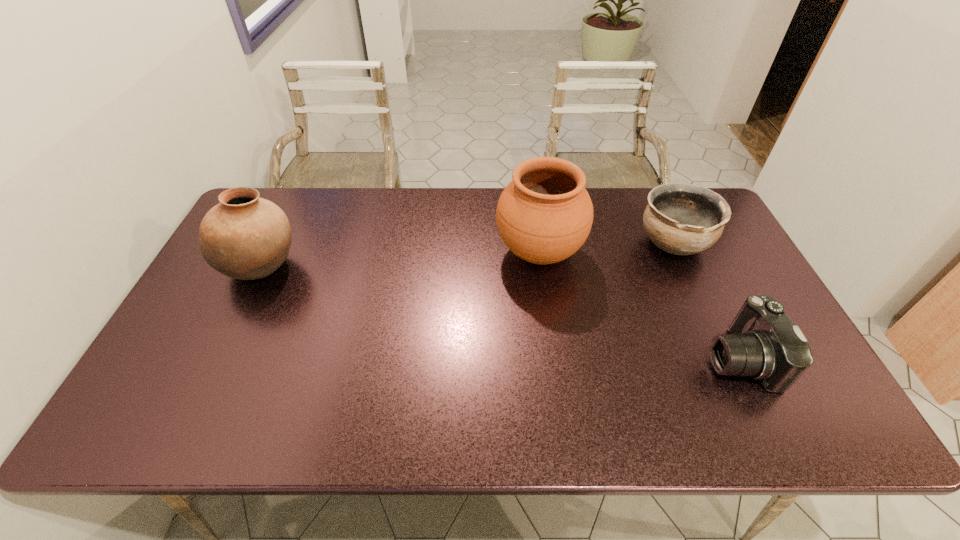
Locate an element on the screen. The image size is (960, 540). object positioned at the left edge is located at coordinates (245, 237).

Where is `pottery that is at the right edge`? This screenshot has width=960, height=540. pottery that is at the right edge is located at coordinates (682, 219).

Find the location of a particular element. This screenshot has width=960, height=540. camera at the right edge is located at coordinates (764, 343).

The width and height of the screenshot is (960, 540). Identify the location of object positioned at the far right corner. (682, 219).

The height and width of the screenshot is (540, 960). In the image, there is a desktop. Identify the location of free space at the far edge. (612, 197).

In the image, there is a desktop. Find the location of `vacant space at the near edge`. vacant space at the near edge is located at coordinates (489, 402).

The width and height of the screenshot is (960, 540). I want to click on vacant space at the left edge of the desktop, so click(173, 398).

The image size is (960, 540). Find the location of `vacant position at the right edge of the desktop`. vacant position at the right edge of the desktop is located at coordinates (741, 301).

You are a GUI agent. You are given a task and a screenshot of the screen. Output one action in this format:
    pyautogui.click(x=<x>, y=<y>)
    Task: Click on the free space at the near right corner of the desktop
    The image size is (960, 540).
    Given the screenshot: What is the action you would take?
    pyautogui.click(x=759, y=408)

Where is `free space between the leftmost object and the third object from right to left`? free space between the leftmost object and the third object from right to left is located at coordinates (401, 260).